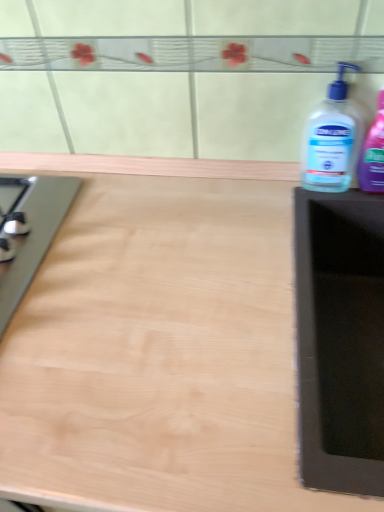
Question: Would you consider transparent plastic bottle at right, arranged as the 2th bottle when viewed from the left, to be distant from transparent plastic bottle at right, which appears as the 2th bottle when viewed from the right?

Choices:
 (A) no
 (B) yes

Answer: (A)

Question: Can you confirm if transparent plastic bottle at right, which is the 1th bottle from right to left, is thinner than transparent plastic bottle at right, the first bottle when ordered from left to right?

Choices:
 (A) yes
 (B) no

Answer: (A)

Question: Does transparent plastic bottle at right, arranged as the 2th bottle when viewed from the left, turn towards transparent plastic bottle at right, which appears as the 2th bottle when viewed from the right?

Choices:
 (A) no
 (B) yes

Answer: (A)

Question: Is transparent plastic bottle at right, which is the 1th bottle from right to left, outside of transparent plastic bottle at right, the first bottle when ordered from left to right?

Choices:
 (A) no
 (B) yes

Answer: (B)

Question: Is transparent plastic bottle at right, which appears as the 2th bottle when viewed from the right, surrounded by transparent plastic bottle at right, arranged as the 2th bottle when viewed from the left?

Choices:
 (A) yes
 (B) no

Answer: (B)

Question: Is transparent plastic bottle at right, which is the 1th bottle from right to left, in front of or behind light wood countertop at center in the image?

Choices:
 (A) front
 (B) behind

Answer: (B)

Question: Looking at the image, does transparent plastic bottle at right, which is the 1th bottle from right to left, seem bigger or smaller compared to light wood countertop at center?

Choices:
 (A) small
 (B) big

Answer: (A)

Question: Is transparent plastic bottle at right, which is the 1th bottle from right to left, wider or thinner than light wood countertop at center?

Choices:
 (A) thin
 (B) wide

Answer: (A)

Question: Do you think transparent plastic bottle at right, arranged as the 2th bottle when viewed from the left, is within light wood countertop at center, or outside of it?

Choices:
 (A) outside
 (B) inside

Answer: (A)

Question: Based on their positions, is transparent plastic bottle at right, arranged as the 2th bottle when viewed from the left, located to the left or right of transparent plastic bottle at right, the first bottle when ordered from left to right?

Choices:
 (A) right
 (B) left

Answer: (A)

Question: Based on their sizes in the image, would you say transparent plastic bottle at right, which is the 1th bottle from right to left, is bigger or smaller than transparent plastic bottle at right, the first bottle when ordered from left to right?

Choices:
 (A) small
 (B) big

Answer: (A)

Question: From their relative heights in the image, would you say transparent plastic bottle at right, which is the 1th bottle from right to left, is taller or shorter than transparent plastic bottle at right, which appears as the 2th bottle when viewed from the right?

Choices:
 (A) tall
 (B) short

Answer: (A)

Question: From the image's perspective, is transparent plastic bottle at right, which is the 1th bottle from right to left, positioned above or below transparent plastic bottle at right, which appears as the 2th bottle when viewed from the right?

Choices:
 (A) above
 (B) below

Answer: (A)

Question: Is transparent plastic bottle at right, the first bottle when ordered from left to right, bigger or smaller than light wood countertop at center?

Choices:
 (A) big
 (B) small

Answer: (B)

Question: From the image's perspective, is transparent plastic bottle at right, which appears as the 2th bottle when viewed from the right, above or below light wood countertop at center?

Choices:
 (A) above
 (B) below

Answer: (A)